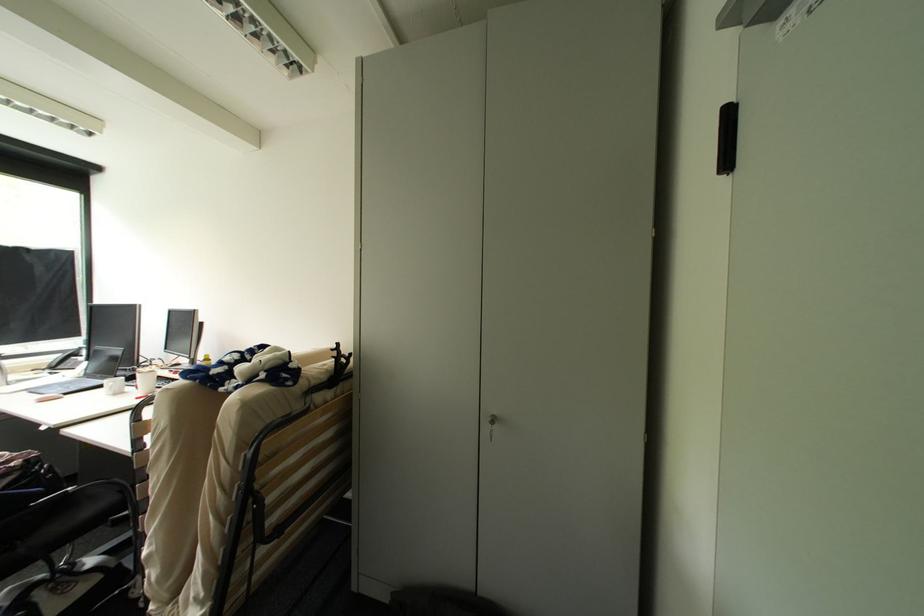
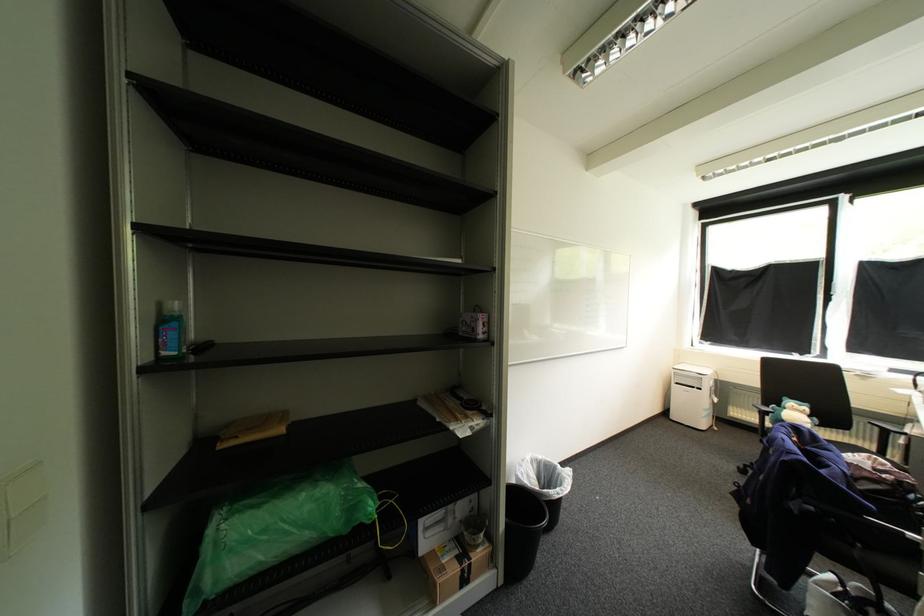
Where in the second image is the point corresponding to (77,490) from the first image?

(917, 535)